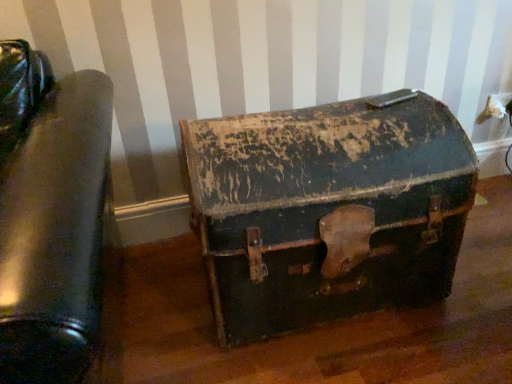
The image size is (512, 384). What are the coordinates of `rusty metal trunk at center` in the screenshot? It's located at (328, 210).

What do you see at coordinates (328, 210) in the screenshot? I see `rusty metal trunk at center` at bounding box center [328, 210].

At what (x,y) coordinates should I click in order to perform the action: click on rusty metal trunk at center. Please return your answer as a coordinate pair (x, y). This screenshot has height=384, width=512. Looking at the image, I should click on (328, 210).